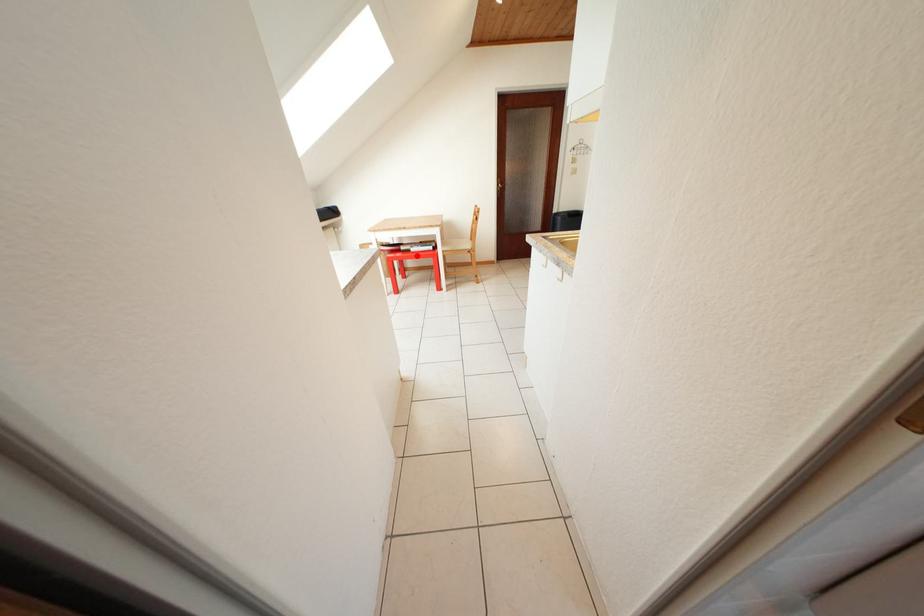
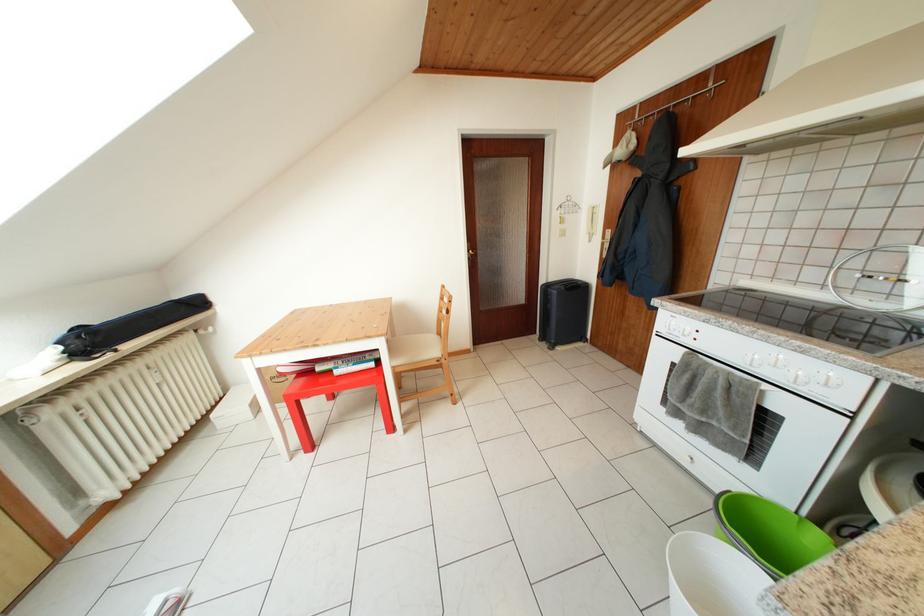
In the second image, find the point that corresponds to the highlighted location in the first image.

(338, 377)